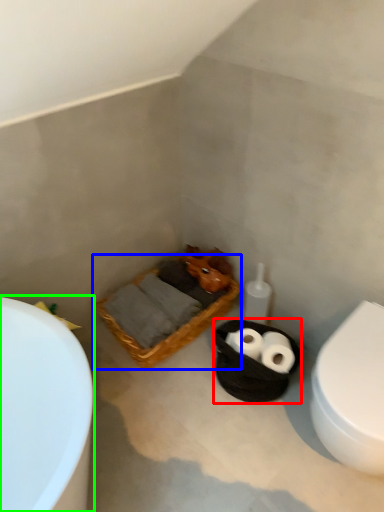
Question: Based on their relative distances, which object is nearer to basket container (highlighted by a red box)? Choose from basket (highlighted by a blue box) and bathtub (highlighted by a green box).

Choices:
 (A) basket
 (B) bathtub

Answer: (A)